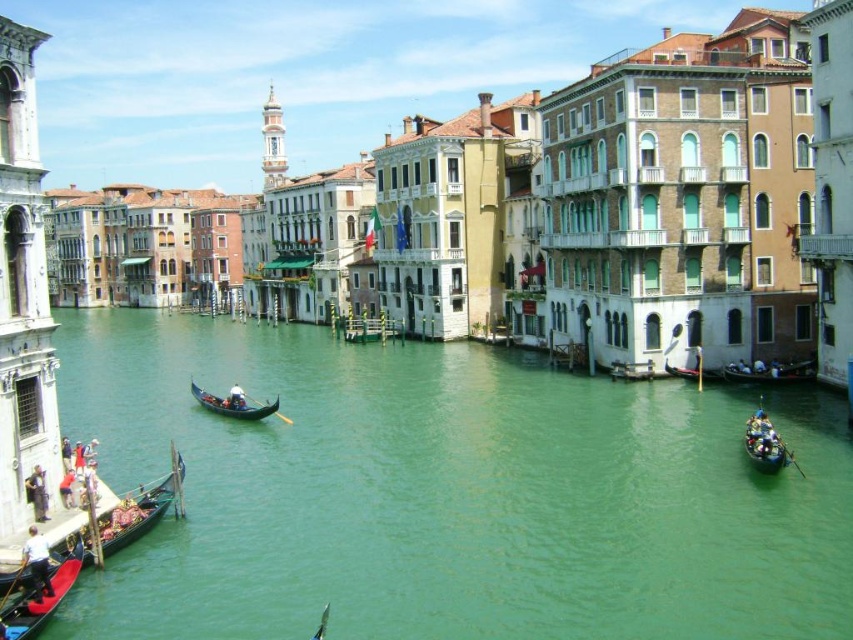
Question: Estimate the real-world distances between objects in this image. Which object is closer to the black polished wood gondola at center?

Choices:
 (A) wooden gondola at lower left
 (B) black polished wood gondola at lower left
 (C) green water at center

Answer: (C)

Question: Does wooden gondola at lower left come in front of black polished wood gondola at lower left?

Choices:
 (A) no
 (B) yes

Answer: (A)

Question: Does black polished wood gondola at lower left have a greater width compared to dark wood gondola at right?

Choices:
 (A) yes
 (B) no

Answer: (B)

Question: Among these points, which one is nearest to the camera?

Choices:
 (A) (155, 522)
 (B) (207, 401)
 (C) (779, 456)

Answer: (A)

Question: Does black polished wood gondola at lower left have a smaller size compared to dark wood gondola at right?

Choices:
 (A) no
 (B) yes

Answer: (B)

Question: Which of the following is the farthest from the observer?

Choices:
 (A) black polished wood gondola at center
 (B) green water at center
 (C) wooden gondola at lower left
 (D) shiny blue boat at lower right

Answer: (A)